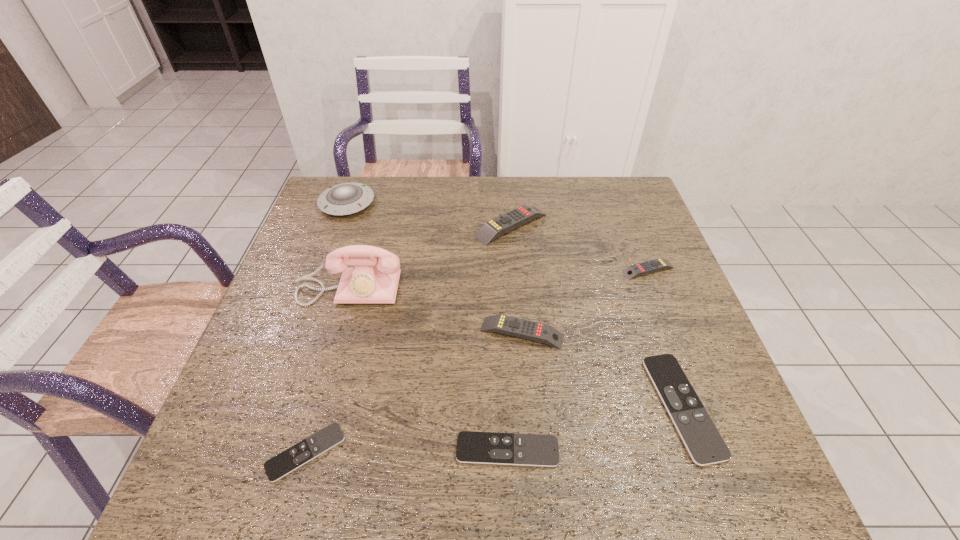
Where is `object located in the near right corner section of the desktop`? This screenshot has height=540, width=960. object located in the near right corner section of the desktop is located at coordinates (700, 436).

Locate an element on the screen. The width and height of the screenshot is (960, 540). free region at the far edge of the desktop is located at coordinates (426, 189).

This screenshot has height=540, width=960. In order to click on blank space at the near edge of the desktop in this screenshot , I will do `click(453, 452)`.

Identify the location of vacant area at the left edge. The image size is (960, 540). (290, 261).

I want to click on free region at the right edge of the desktop, so click(x=655, y=335).

The image size is (960, 540). Identify the location of free space at the far left corner of the desktop. (322, 193).

Locate an element on the screen. free spot at the far right corner of the desktop is located at coordinates (634, 211).

Find the location of a particular element. This screenshot has height=540, width=960. free space that is in between the leftmost remote control and the second black remote control from right to left is located at coordinates (407, 451).

Where is `free space between the second shortest object and the second farthest remote control`? The height and width of the screenshot is (540, 960). free space between the second shortest object and the second farthest remote control is located at coordinates (578, 360).

Locate an element on the screen. free area in between the biggest black remote control and the telephone is located at coordinates (516, 348).